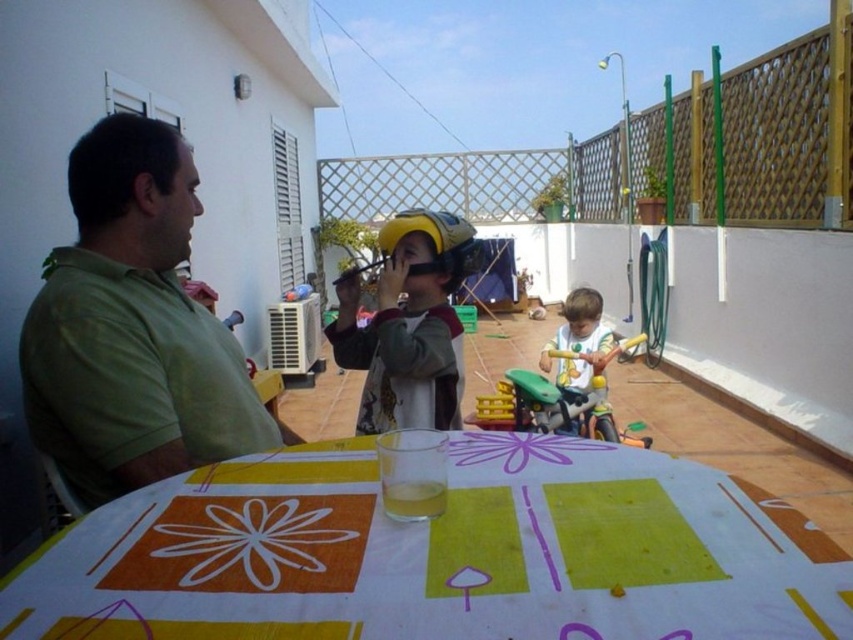
Is yellow matte helmet at center thinner than white plastic toy at center?

No.

Can you confirm if yellow matte helmet at center is smaller than white plastic toy at center?

Indeed, yellow matte helmet at center has a smaller size compared to white plastic toy at center.

Which is behind, point (381, 371) or point (558, 360)?

The point (558, 360) is behind.

At what (x,y) coordinates should I click in order to perform the action: click on yellow matte helmet at center. Please return your answer as a coordinate pair (x, y). The height and width of the screenshot is (640, 853). Looking at the image, I should click on (x=408, y=324).

Is green matte shirt at left wider than white plastic toy at center?

Yes.

This screenshot has height=640, width=853. What are the coordinates of `green matte shirt at left` in the screenshot? It's located at (132, 328).

Which is in front, point (109, 157) or point (582, 387)?

Positioned in front is point (109, 157).

Where is `green matte shirt at left`? The height and width of the screenshot is (640, 853). green matte shirt at left is located at coordinates (132, 328).

Is printed fabric table at center positioned before white plastic toy at center?

Yes, it is.

Can you confirm if printed fabric table at center is positioned to the right of white plastic toy at center?

No, printed fabric table at center is not to the right of white plastic toy at center.

What do you see at coordinates (439, 554) in the screenshot?
I see `printed fabric table at center` at bounding box center [439, 554].

Where is `printed fabric table at center`? The image size is (853, 640). printed fabric table at center is located at coordinates (439, 554).